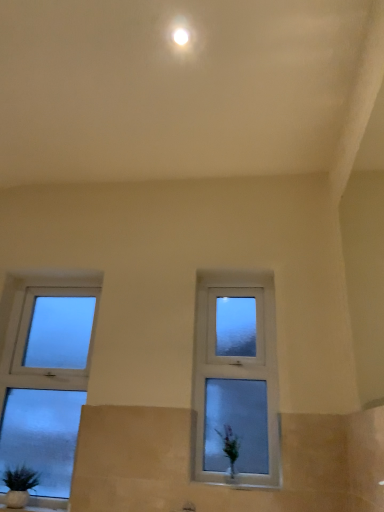
Question: Considering the relative sizes of green matte plant at lower left and frosted glass window at left, which ranks as the first window in left-to-right order, in the image provided, is green matte plant at lower left bigger than frosted glass window at left, which ranks as the first window in left-to-right order,?

Choices:
 (A) no
 (B) yes

Answer: (A)

Question: Does green matte plant at lower left lie behind frosted glass window at left, which ranks as the 2th window in right-to-left order?

Choices:
 (A) no
 (B) yes

Answer: (A)

Question: Can frosted glass window at left, which ranks as the first window in left-to-right order, be found inside green matte plant at lower left?

Choices:
 (A) yes
 (B) no

Answer: (B)

Question: Is green matte plant at lower left not within frosted glass window at left, which ranks as the first window in left-to-right order?

Choices:
 (A) no
 (B) yes

Answer: (B)

Question: Does green matte plant at lower left appear on the right side of frosted glass window at left, which ranks as the first window in left-to-right order?

Choices:
 (A) no
 (B) yes

Answer: (A)

Question: Is white glossy vase at lower center spatially inside frosted glass window at left, which ranks as the first window in left-to-right order, or outside of it?

Choices:
 (A) inside
 (B) outside

Answer: (B)

Question: Considering the positions of white glossy vase at lower center and frosted glass window at left, which ranks as the first window in left-to-right order, in the image, is white glossy vase at lower center wider or thinner than frosted glass window at left, which ranks as the first window in left-to-right order,?

Choices:
 (A) thin
 (B) wide

Answer: (B)

Question: Does point (225, 480) appear closer or farther from the camera than point (94, 283)?

Choices:
 (A) farther
 (B) closer

Answer: (B)

Question: Looking at the image, does white glossy vase at lower center seem bigger or smaller compared to frosted glass window at left, which ranks as the 2th window in right-to-left order?

Choices:
 (A) big
 (B) small

Answer: (B)

Question: Is white glossy light at upper center bigger or smaller than white glossy vase at lower center?

Choices:
 (A) small
 (B) big

Answer: (A)

Question: In terms of height, does white glossy light at upper center look taller or shorter compared to white glossy vase at lower center?

Choices:
 (A) tall
 (B) short

Answer: (B)

Question: Do you think white glossy light at upper center is within white glossy vase at lower center, or outside of it?

Choices:
 (A) inside
 (B) outside

Answer: (B)

Question: Considering the positions of white glossy light at upper center and white glossy vase at lower center in the image, is white glossy light at upper center wider or thinner than white glossy vase at lower center?

Choices:
 (A) wide
 (B) thin

Answer: (B)

Question: Is frosted glass window at left, which ranks as the first window in left-to-right order, bigger or smaller than white glossy light at upper center?

Choices:
 (A) big
 (B) small

Answer: (A)

Question: Considering the relative positions of frosted glass window at left, which ranks as the 2th window in right-to-left order, and white glossy light at upper center in the image provided, is frosted glass window at left, which ranks as the 2th window in right-to-left order, to the left or to the right of white glossy light at upper center?

Choices:
 (A) left
 (B) right

Answer: (A)